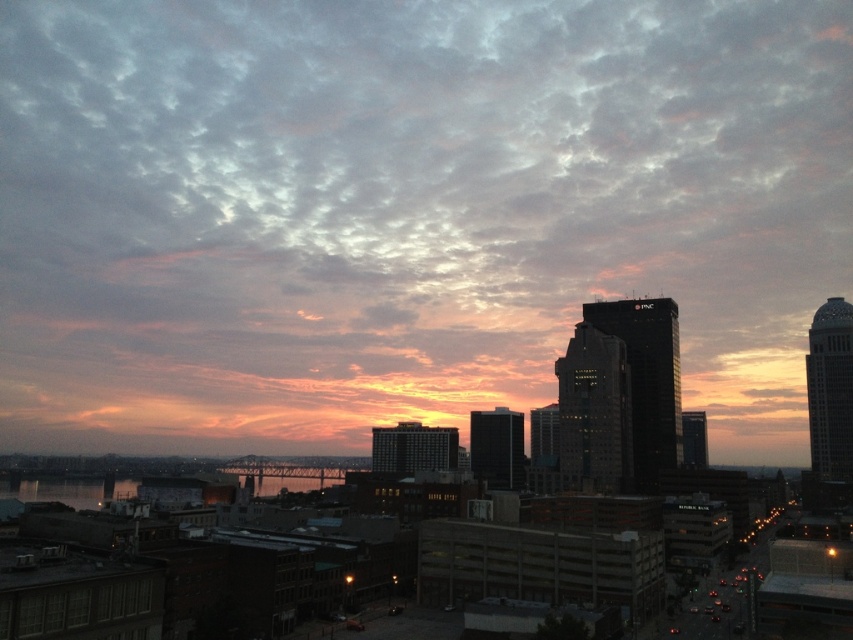
You are an architect designing a new building in the city. You want to ensure that the building doesn not block the view of the cloudy sky at upper center from the reflective glass water at center. Based on the scene, what should you consider about the building s height?

The cloudy sky at upper center is positioned over reflective glass water at center, so the building should be designed to not exceed the height of the reflective glass water at center to maintain the view of the sky.

You are a photographer trying to capture the cloudy sky at upper center in your shot. Based on its position, where should you aim your camera?

The cloudy sky at upper center is located at coordinates point (405,211), so aim your camera there to capture it.